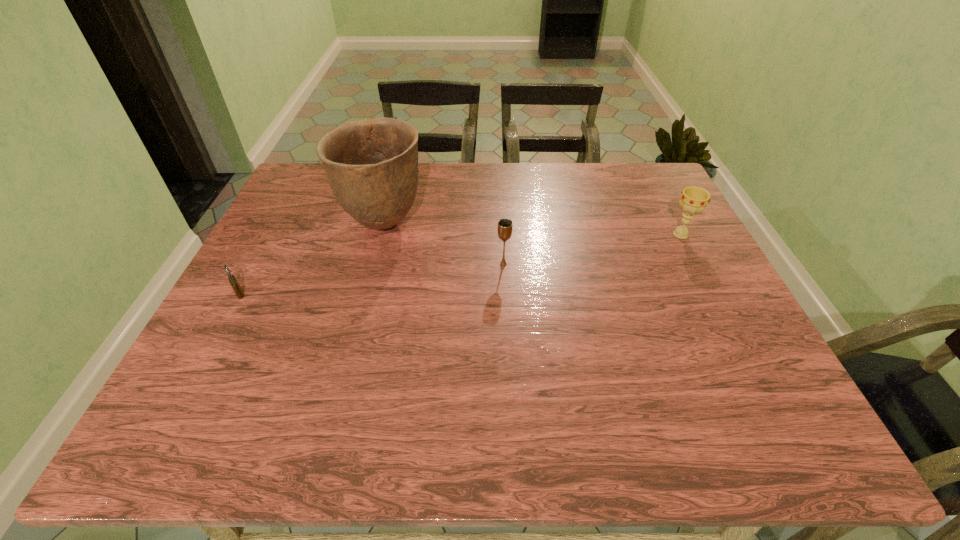
Where is `object identified as the closest to the left chalice`? The height and width of the screenshot is (540, 960). object identified as the closest to the left chalice is located at coordinates (372, 165).

This screenshot has width=960, height=540. I want to click on the closest object relative to the tallest object, so click(505, 225).

The image size is (960, 540). Find the location of `vacant region that satisfies the following two spatial constraints: 1. on the back side of the pottery; 2. on the right side of the padlock`. vacant region that satisfies the following two spatial constraints: 1. on the back side of the pottery; 2. on the right side of the padlock is located at coordinates (276, 224).